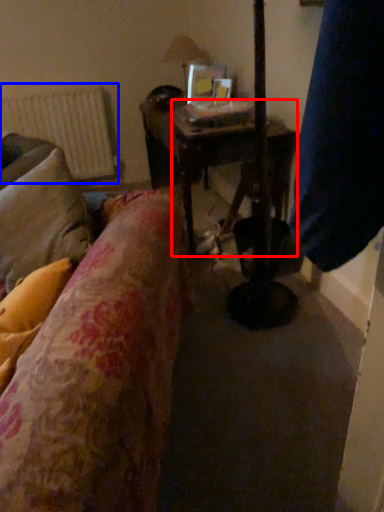
Question: Which object appears closest to the camera in this image, table (highlighted by a red box) or radiator (highlighted by a blue box)?

Choices:
 (A) table
 (B) radiator

Answer: (A)